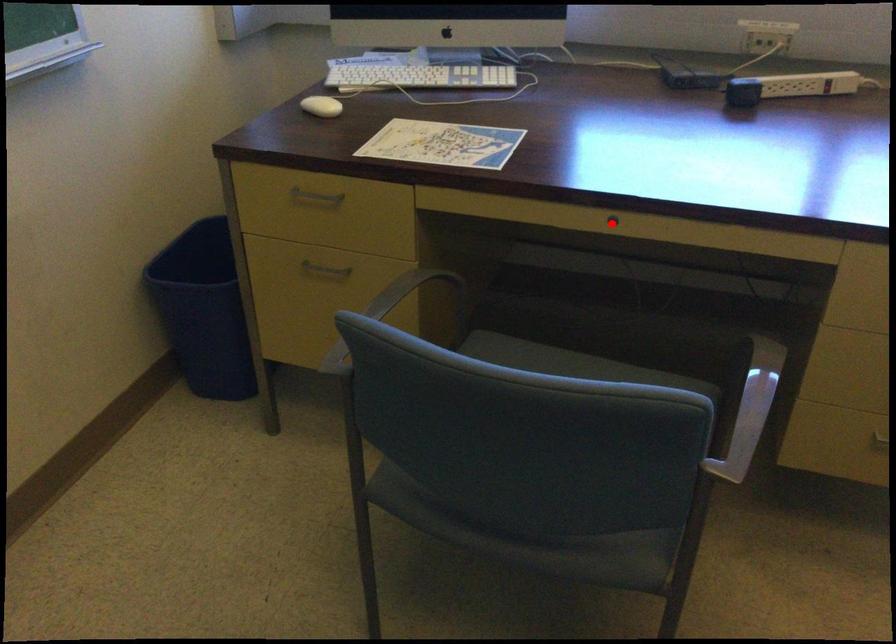
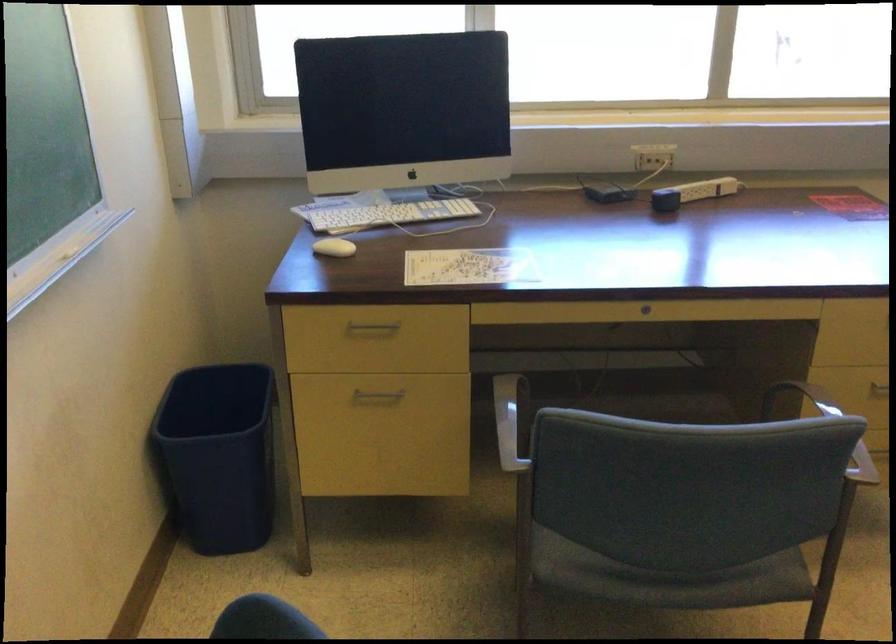
Question: I am providing you with two images of the same scene from different viewpoints. In image1, a red point is highlighted. Considering the same 3D point in image2, which of the following is correct?

Choices:
 (A) It is closer
 (B) It is farther

Answer: (B)